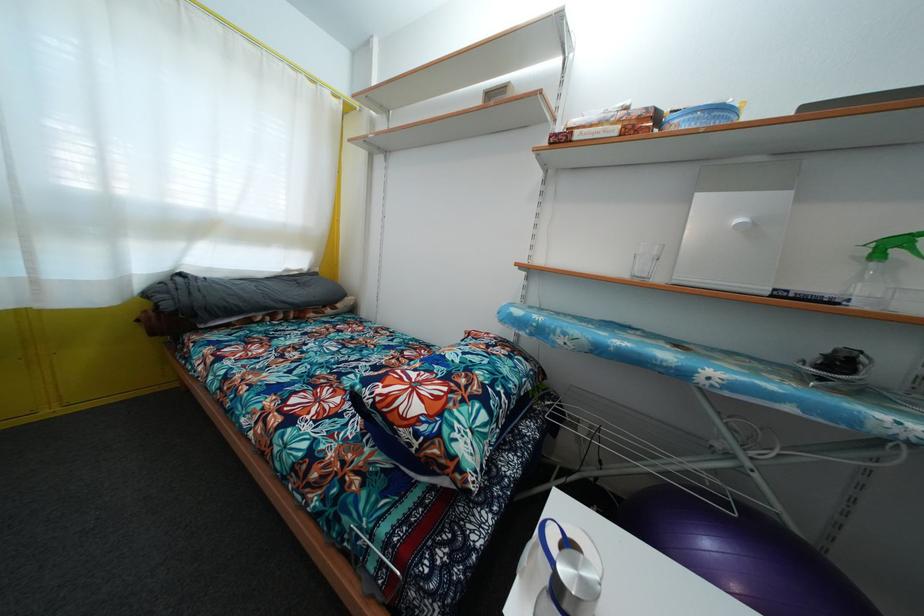
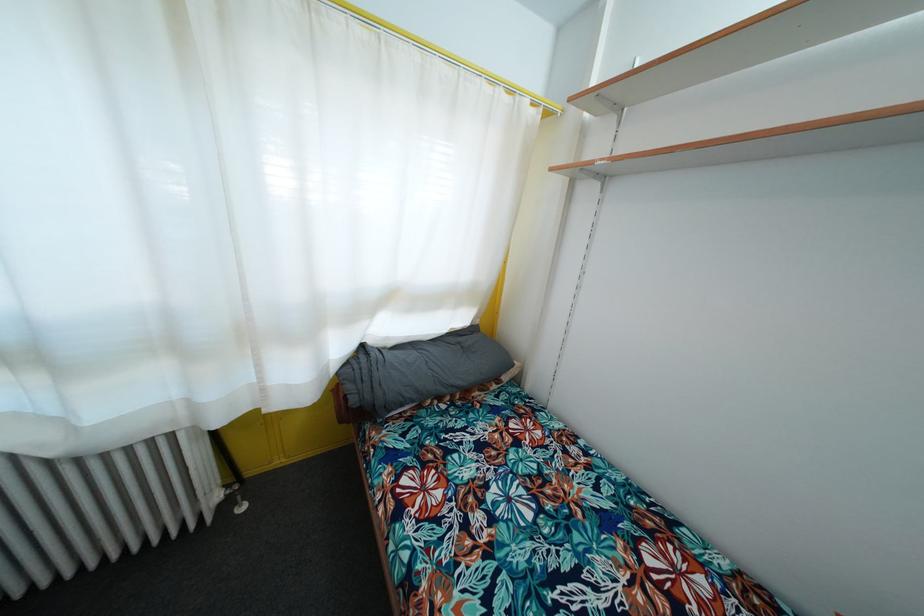
Question: The camera is either moving clockwise (left) or counter-clockwise (right) around the object. The first image is from the beginning of the video and the second image is from the end. Is the camera moving left or right when shooting the video?

Choices:
 (A) Left
 (B) Right

Answer: (B)